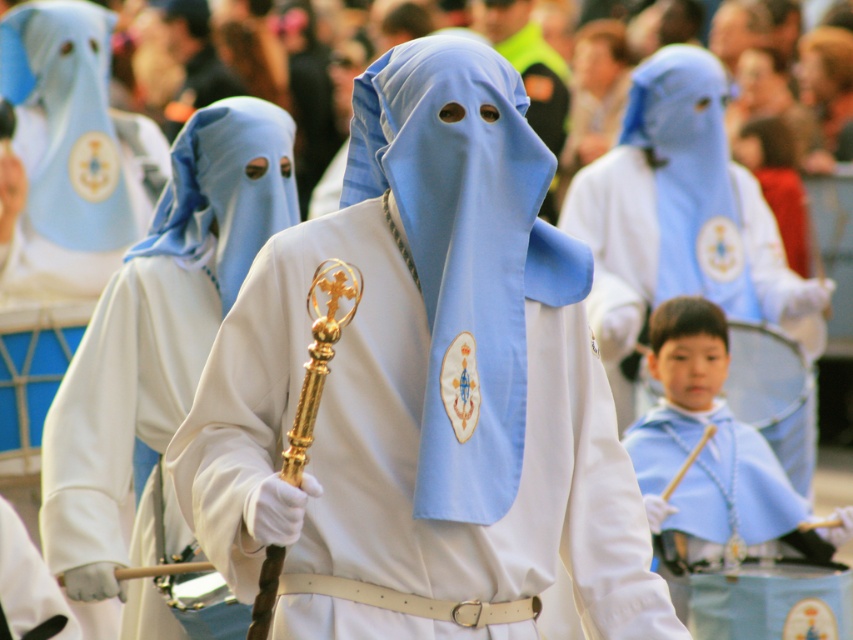
Question: Does light blue fabric at lower right appear under matte blue fabric at center?

Choices:
 (A) no
 (B) yes

Answer: (B)

Question: Estimate the real-world distances between objects in this image. Which object is closer to the light blue fabric at lower right?

Choices:
 (A) matte blue fabric at center
 (B) matte white robe at center

Answer: (B)

Question: Estimate the real-world distances between objects in this image. Which object is closer to the matte white robe at center?

Choices:
 (A) matte blue fabric at center
 (B) light blue fabric at lower right

Answer: (B)

Question: Does matte white robe at center have a greater width compared to matte blue fabric at center?

Choices:
 (A) yes
 (B) no

Answer: (A)

Question: Does matte white robe at center appear on the right side of matte blue fabric at center?

Choices:
 (A) no
 (B) yes

Answer: (B)

Question: Which object is the farthest from the light blue fabric at lower right?

Choices:
 (A) matte white robe at center
 (B) matte blue fabric at center

Answer: (B)